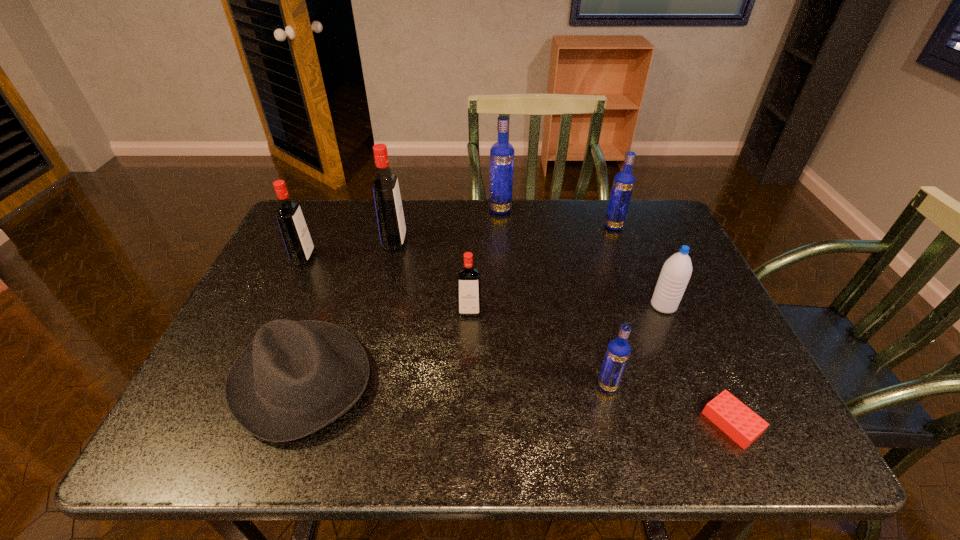
Image resolution: width=960 pixels, height=540 pixels. I want to click on vacant space that satisfies the following two spatial constraints: 1. on the front side of the nearest vodka; 2. on the left side of the shortest object, so point(617,423).